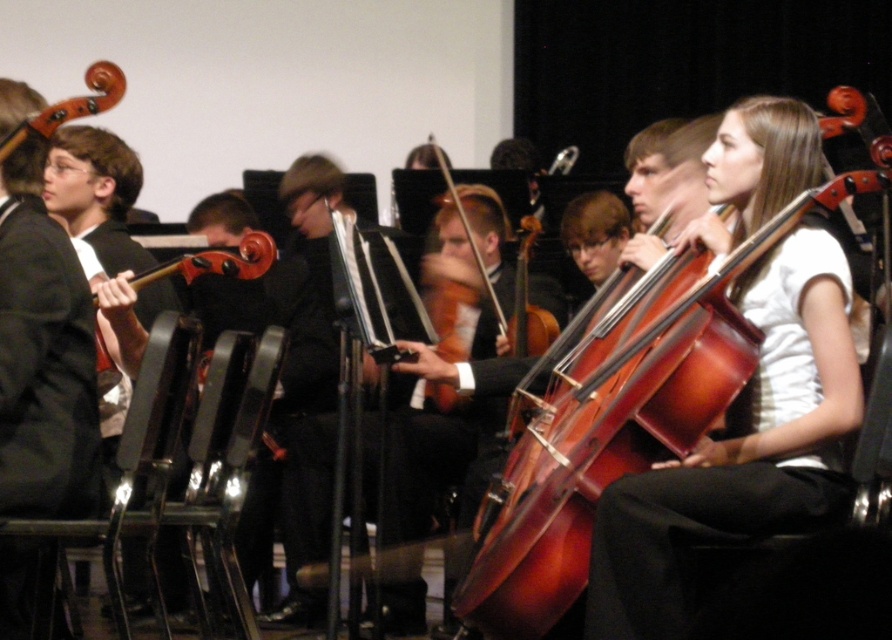
You are a stagehand in the auditorium and need to place a small prop on the stage. You have two options for placement based on coordinates given in the image. The first option is at point (x=796, y=164) and the second is at point (x=109, y=61). If you want the prop to be closer to the audience, which coordinate should you choose?

Point (x=796, y=164) is in front of point (x=109, y=61), so placing the prop at point (x=796, y=164) would make it closer to the audience.

You are standing at the camera position in the auditorium watching the musicians. There is a point in the scene at coordinates point (686,458). If you want to throw a small object to that point, will it land within 10 feet of you?

The distance between point (686,458) and the camera is 8.88 feet, so yes, the object will land within 10 feet of you.

You are a photographer standing at the back of the auditorium and want to take a photo of the shiny black hat at center and the wooden violin at upper left. Which object will appear larger in your photo?

The shiny black hat at center will appear larger in the photo because it is closer to the photographer than the wooden violin at upper left.